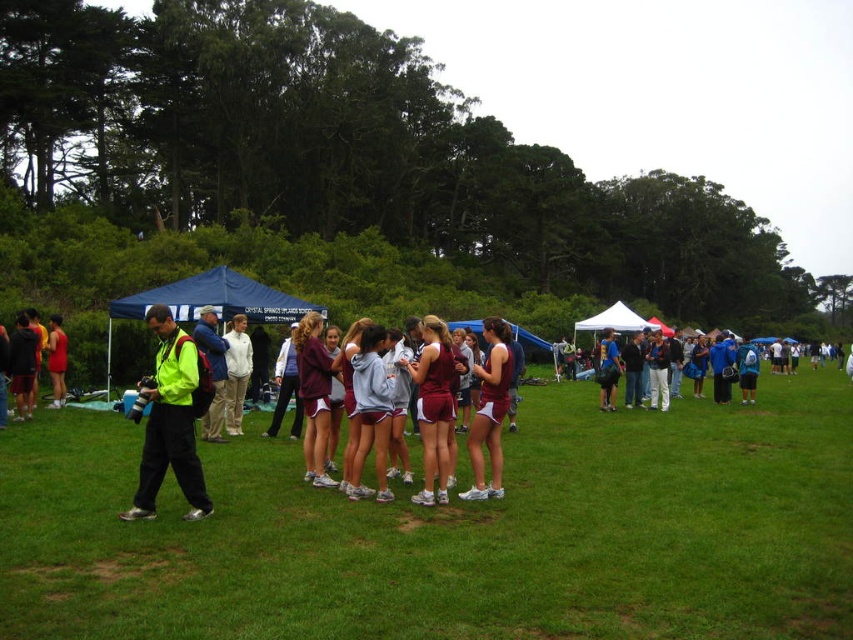
You are a photographer who needs to capture a closeup shot of the white cotton hoodie at center from the camera. Given that your camera has a minimum focusing distance of 12 meters, will you be able to take the photo without moving closer?

The distance between the white cotton hoodie at center and the camera is 11.70 meters. Since your camera requires a minimum focusing distance of 12 meters, you are too close to the subject to take a clear photo without moving further away.

You are a photographer at the cross country meet. You need to decide which clothing item to wear for better visibility. The white cotton hoodie at center and the matte green jacket at left are available. Which one is bigger and thus more visible from a distance?

The white cotton hoodie at center has a larger size compared to matte green jacket at left, so it would be more visible from a distance.

You are a spectator at the event and want to take a photo of the athletes. You notice the neon yellow jacket at left and the matte green jacket at left. Which jacket is closer to the ground?

The neon yellow jacket at left is below matte green jacket at left, so it is closer to the ground.